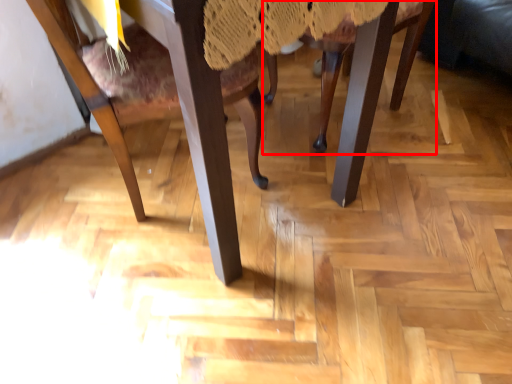
Question: From the image's perspective, what is the correct spatial positioning of chair (annotated by the red box) in reference to chair?

Choices:
 (A) below
 (B) above

Answer: (B)